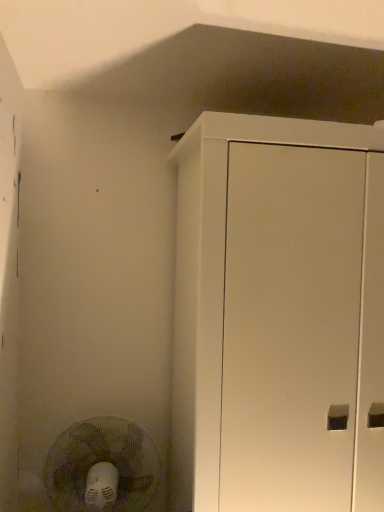
The width and height of the screenshot is (384, 512). What do you see at coordinates (102, 463) in the screenshot?
I see `white plastic fan at lower left` at bounding box center [102, 463].

You are a GUI agent. You are given a task and a screenshot of the screen. Output one action in this format:
    pyautogui.click(x=<x>, y=<y>)
    Task: Click on the white plastic fan at lower left
    This screenshot has height=512, width=384.
    Given the screenshot: What is the action you would take?
    pyautogui.click(x=102, y=463)

I want to click on white plastic fan at lower left, so click(x=102, y=463).